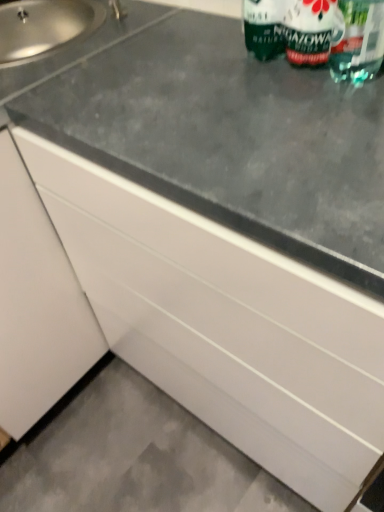
What are the coordinates of `free space above gray concrete at lower left (from a real-world perspective)` in the screenshot? It's located at (127, 460).